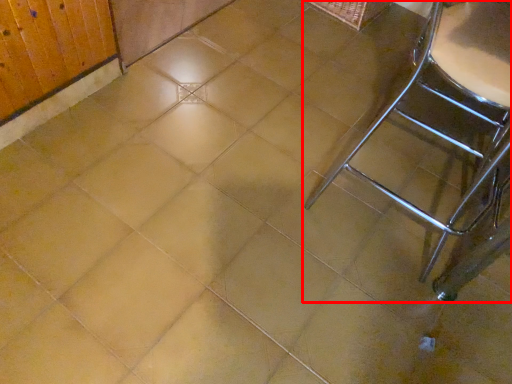
Question: From the image's perspective, what is the correct spatial relationship of furniture (annotated by the red box) in relation to basket?

Choices:
 (A) above
 (B) below

Answer: (B)